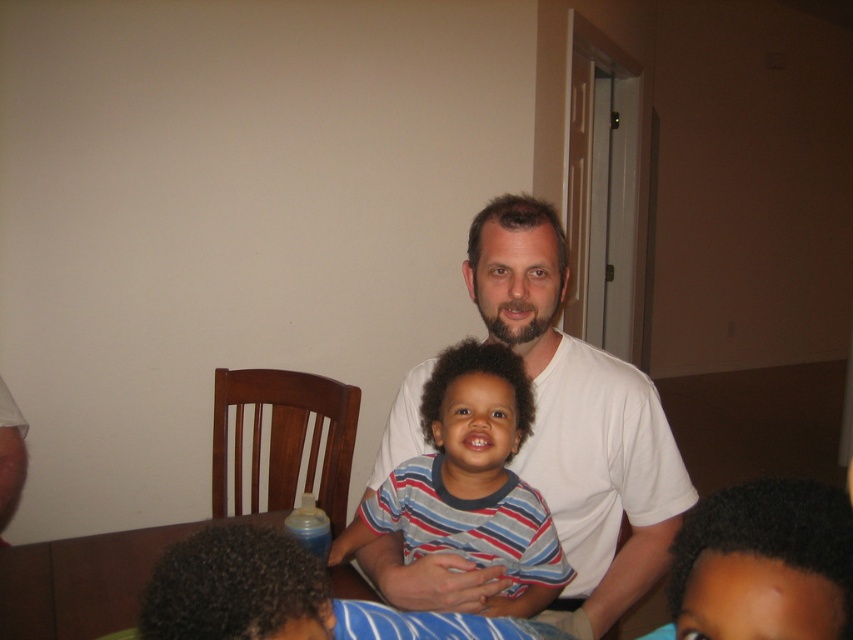
Question: Which point is farther to the camera?

Choices:
 (A) (345, 582)
 (B) (508, 365)

Answer: (A)

Question: Estimate the real-world distances between objects in this image. Which object is closer to the striped cotton shirt at center?

Choices:
 (A) white smooth shirt at center
 (B) brown wooden table at lower center

Answer: (A)

Question: Which of these objects is positioned closest to the white smooth shirt at center?

Choices:
 (A) brown wooden table at lower center
 (B) striped cotton shirt at center

Answer: (B)

Question: Does striped cotton shirt at center lie behind brown wooden table at lower center?

Choices:
 (A) yes
 (B) no

Answer: (B)

Question: Can you confirm if white smooth shirt at center is wider than brown wooden table at lower center?

Choices:
 (A) yes
 (B) no

Answer: (B)

Question: Can you confirm if white smooth shirt at center is positioned above striped cotton shirt at center?

Choices:
 (A) no
 (B) yes

Answer: (B)